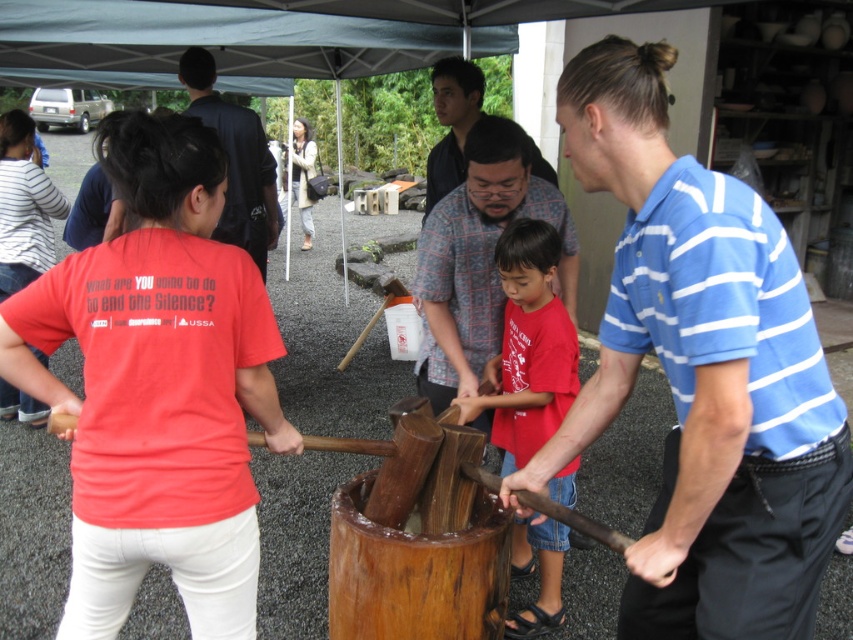
Question: Which object is positioned closest to the matte red shirt at center?

Choices:
 (A) dark blue suit at upper left
 (B) plaid shirt at center
 (C) patterned fabric shirt at center
 (D) blue striped shirt at center

Answer: (D)

Question: Estimate the real-world distances between objects in this image. Which object is farther from the dark blue suit at upper left?

Choices:
 (A) plaid shirt at center
 (B) blue striped shirt at center
 (C) patterned fabric shirt at center

Answer: (B)

Question: Can you confirm if dark blue suit at upper left is bigger than plaid shirt at center?

Choices:
 (A) yes
 (B) no

Answer: (A)

Question: Which object appears farthest from the camera in this image?

Choices:
 (A) dark blue suit at upper left
 (B) matte red shirt at center

Answer: (A)

Question: Does blue striped shirt at center appear on the left side of plaid shirt at center?

Choices:
 (A) yes
 (B) no

Answer: (B)

Question: Is blue striped shirt at center thinner than matte red shirt at center?

Choices:
 (A) no
 (B) yes

Answer: (A)